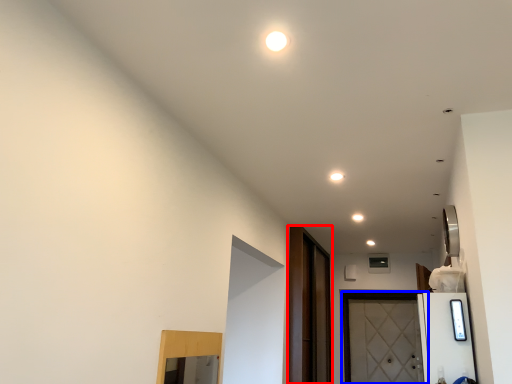
Question: Among these objects, which one is nearest to the camera, screen door (highlighted by a red box) or door (highlighted by a blue box)?

Choices:
 (A) screen door
 (B) door

Answer: (A)